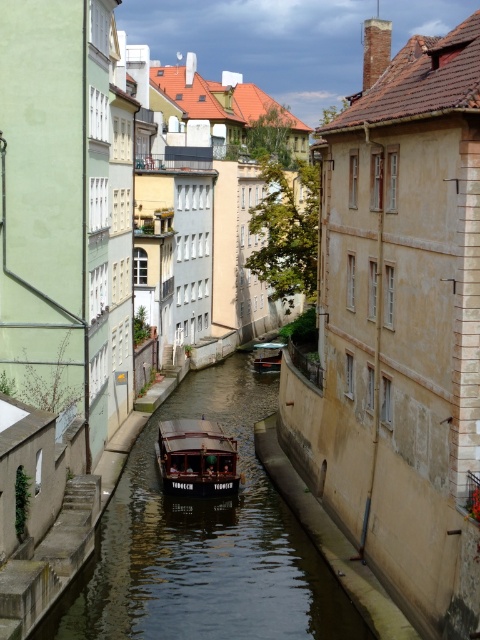
Question: Does smooth dark water at center appear on the left side of wooden polished boat at center?

Choices:
 (A) yes
 (B) no

Answer: (A)

Question: Among these points, which one is farthest from the camera?

Choices:
 (A) (204, 465)
 (B) (276, 625)

Answer: (A)

Question: Is smooth dark water at center closer to camera compared to wooden boat at center?

Choices:
 (A) yes
 (B) no

Answer: (A)

Question: Does wooden boat at center have a smaller size compared to wooden polished boat at center?

Choices:
 (A) no
 (B) yes

Answer: (A)

Question: Which object appears closest to the camera in this image?

Choices:
 (A) wooden boat at center
 (B) smooth dark water at center
 (C) wooden polished boat at center

Answer: (B)

Question: Among these objects, which one is farthest from the camera?

Choices:
 (A) smooth dark water at center
 (B) wooden polished boat at center

Answer: (B)